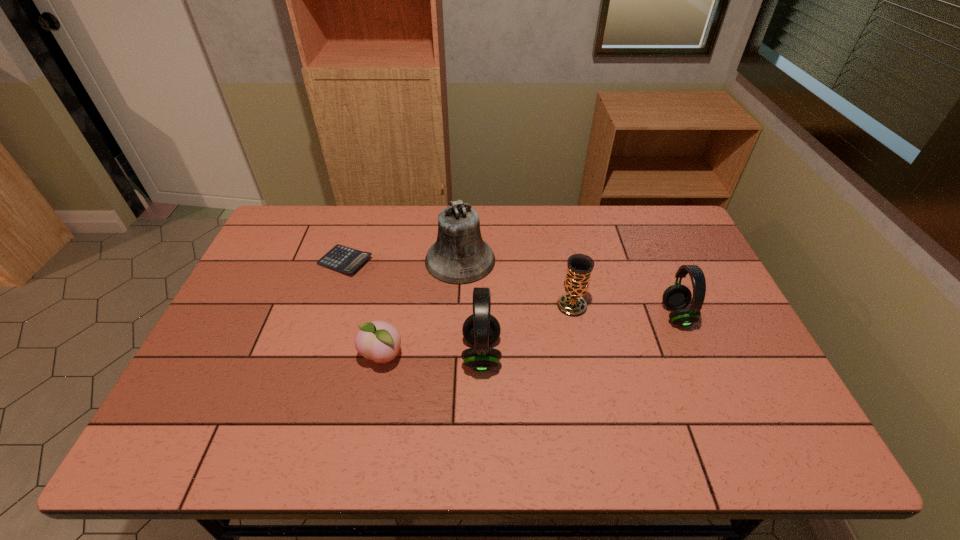
What are the coordinates of `the taller headset` in the screenshot? It's located at (481, 329).

Identify the location of the rightmost object. The image size is (960, 540). (677, 297).

The image size is (960, 540). I want to click on the right headset, so click(x=677, y=297).

Identify the location of calculator. The height and width of the screenshot is (540, 960). (340, 258).

The height and width of the screenshot is (540, 960). I want to click on the leftmost object, so click(340, 258).

Image resolution: width=960 pixels, height=540 pixels. What are the coordinates of `the second object from right to left` in the screenshot? It's located at (579, 266).

Find the location of a particular element. The image size is (960, 540). bell is located at coordinates (459, 256).

I want to click on the fifth tallest object, so click(x=380, y=341).

Where is `peach`? This screenshot has height=540, width=960. peach is located at coordinates (380, 341).

This screenshot has height=540, width=960. I want to click on free location located on the ear cups of the taller headset, so click(624, 354).